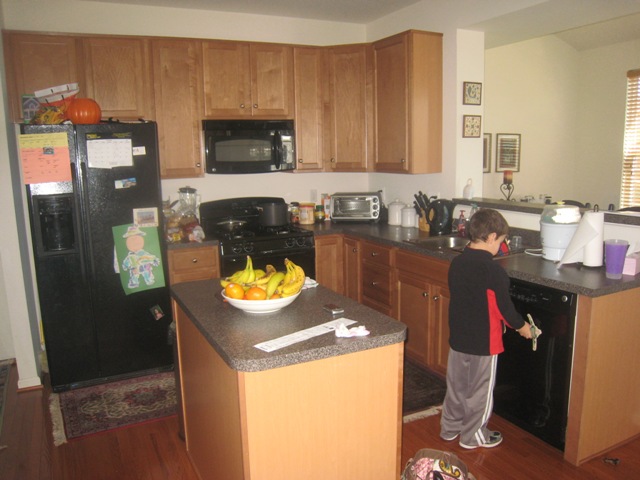
What are the coordinates of `microwave` in the screenshot? It's located at (353, 202).